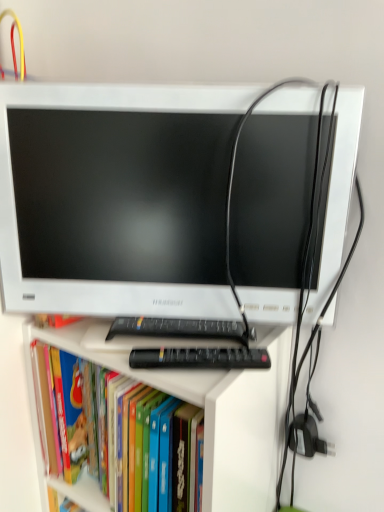
Where is `black plastic keyboard at center`? The height and width of the screenshot is (512, 384). black plastic keyboard at center is located at coordinates (178, 328).

What do you see at coordinates (113, 433) in the screenshot?
I see `hardcover book at center` at bounding box center [113, 433].

Locate an element on the screen. white plastic computer monitor at center is located at coordinates (116, 199).

The width and height of the screenshot is (384, 512). What are the coordinates of `black plastic keyboard at center` in the screenshot? It's located at (178, 328).

Does black plastic keyboard at center have a greater width compared to white plastic computer monitor at center?

No.

How distant is black plastic keyboard at center from white plastic computer monitor at center?

A distance of 7.51 inches exists between black plastic keyboard at center and white plastic computer monitor at center.

Does black plastic keyboard at center come in front of white plastic computer monitor at center?

No, black plastic keyboard at center is behind white plastic computer monitor at center.

Which is more to the left, black plastic keyboard at center or white plastic computer monitor at center?

white plastic computer monitor at center is more to the left.

From the image's perspective, does hardcover book at center appear higher than white plastic computer monitor at center?

No, from the image's perspective, hardcover book at center is not on top of white plastic computer monitor at center.

Is hardcover book at center with white plastic computer monitor at center?

hardcover book at center is not next to white plastic computer monitor at center, and they're not touching.

Looking at their sizes, would you say hardcover book at center is wider or thinner than white plastic computer monitor at center?

Clearly, hardcover book at center has more width compared to white plastic computer monitor at center.

How much distance is there between hardcover book at center and white plastic computer monitor at center?

A distance of 10.54 inches exists between hardcover book at center and white plastic computer monitor at center.

From a real-world perspective, who is located lower, white plastic computer monitor at center or hardcover book at center?

hardcover book at center.

In the image, there is a white plastic computer monitor at center. Where is `book below it (from the image's perspective)`? The height and width of the screenshot is (512, 384). book below it (from the image's perspective) is located at coordinates (113, 433).

From the image's perspective, which is below, white plastic computer monitor at center or hardcover book at center?

hardcover book at center, from the image's perspective.

Is white plastic computer monitor at center inside the boundaries of black plastic keyboard at center, or outside?

white plastic computer monitor at center is not inside black plastic keyboard at center, it's outside.

Considering the sizes of white plastic computer monitor at center and black plastic keyboard at center in the image, is white plastic computer monitor at center bigger or smaller than black plastic keyboard at center?

Clearly, white plastic computer monitor at center is larger in size than black plastic keyboard at center.

Would you consider white plastic computer monitor at center to be distant from black plastic keyboard at center?

white plastic computer monitor at center is actually quite close to black plastic keyboard at center.

Measure the distance between black plastic keyboard at center and hardcover book at center.

black plastic keyboard at center and hardcover book at center are 20.23 centimeters apart from each other.

Can you confirm if black plastic keyboard at center is thinner than hardcover book at center?

Indeed, black plastic keyboard at center has a lesser width compared to hardcover book at center.

Does point (153, 332) come in front of point (116, 384)?

Yes, it is.

Is black plastic keyboard at center positioned with its back to hardcover book at center?

No, black plastic keyboard at center is not facing the opposite direction of hardcover book at center.

Are hardcover book at center and black plastic keyboard at center making contact?

No, hardcover book at center is not with black plastic keyboard at center.

From the image's perspective, is hardcover book at center located above black plastic keyboard at center?

Incorrect, from the image's perspective, hardcover book at center is lower than black plastic keyboard at center.

The width and height of the screenshot is (384, 512). Find the location of `keyboard behind the hardcover book at center`. keyboard behind the hardcover book at center is located at coordinates (178, 328).

Identify the location of computer monitor above the black plastic keyboard at center (from a real-world perspective). (116, 199).

Locate an element on the screen. The height and width of the screenshot is (512, 384). computer monitor on the right of hardcover book at center is located at coordinates (116, 199).

Considering their positions, is hardcover book at center positioned closer to black plastic keyboard at center than white plastic computer monitor at center?

Based on the image, white plastic computer monitor at center appears to be nearer to black plastic keyboard at center.

Looking at this image, based on their spatial positions, is white plastic computer monitor at center or black plastic keyboard at center closer to hardcover book at center?

black plastic keyboard at center.

Which object lies further to the anchor point black plastic keyboard at center, white plastic computer monitor at center or hardcover book at center?

hardcover book at center lies further to black plastic keyboard at center than the other object.

Estimate the real-world distances between objects in this image. Which object is closer to white plastic computer monitor at center, black plastic keyboard at center or hardcover book at center?

black plastic keyboard at center lies closer to white plastic computer monitor at center than the other object.

When comparing their distances from white plastic computer monitor at center, does hardcover book at center or black plastic keyboard at center seem closer?

black plastic keyboard at center.

Estimate the real-world distances between objects in this image. Which object is further from hardcover book at center, black plastic keyboard at center or white plastic computer monitor at center?

white plastic computer monitor at center.

What are the coordinates of `keyboard between white plastic computer monitor at center and hardcover book at center in the vertical direction` in the screenshot? It's located at (178, 328).